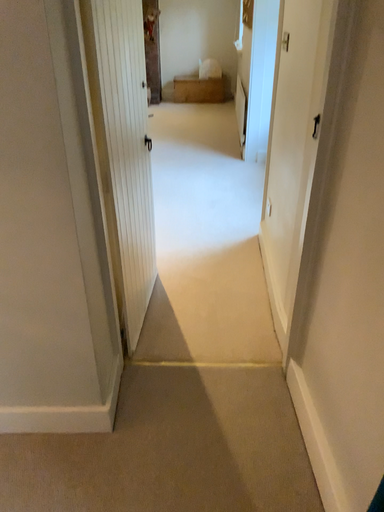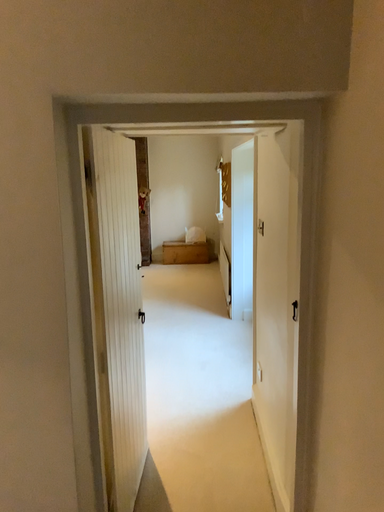
Question: How did the camera likely rotate when shooting the video?

Choices:
 (A) rotated upward
 (B) rotated downward

Answer: (A)